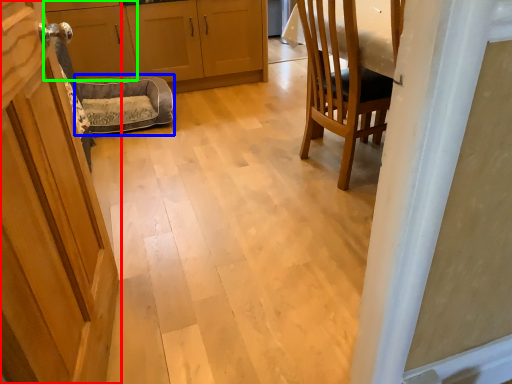
Question: Based on their relative distances, which object is farther from door (highlighted by a red box)? Choose from dog bed (highlighted by a blue box) and cabinetry (highlighted by a green box).

Choices:
 (A) dog bed
 (B) cabinetry

Answer: (B)